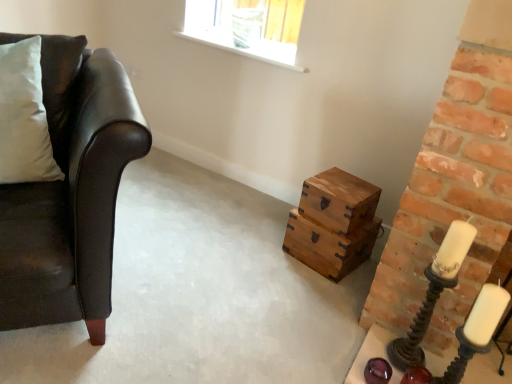
This screenshot has height=384, width=512. What are the coordinates of `free space in front of wooden chest at center-right` in the screenshot? It's located at (312, 288).